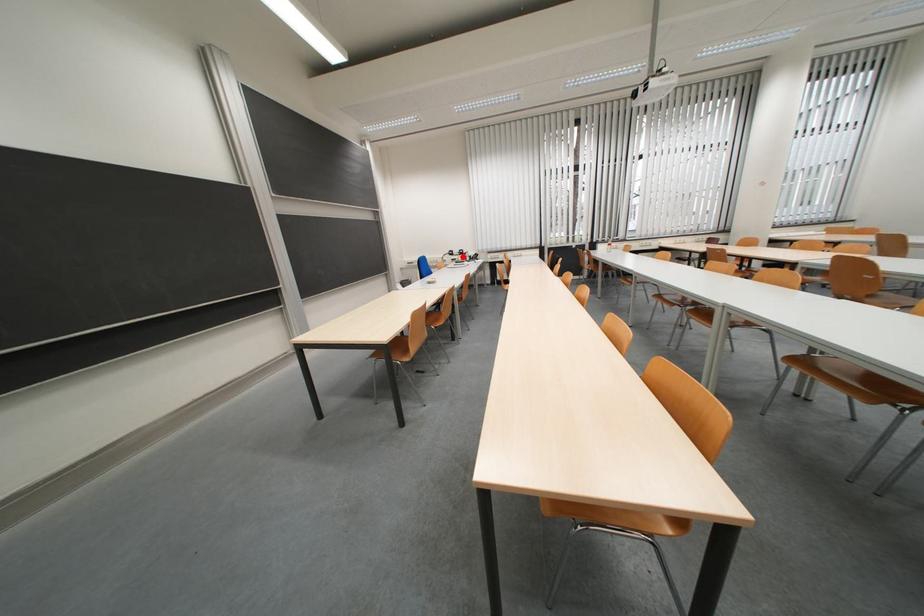
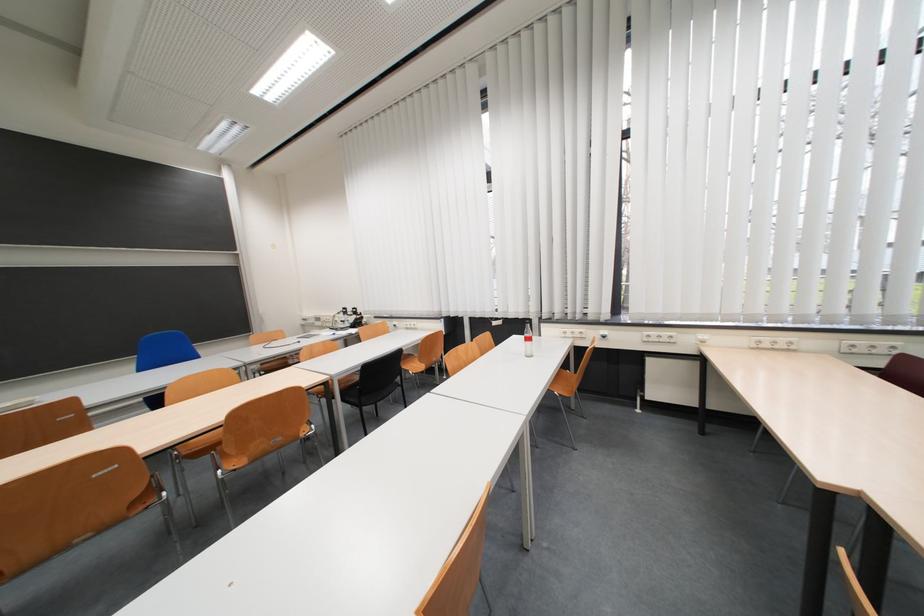
Where in the second image is the point corresponding to the highlighted location from the first image?

(357, 315)